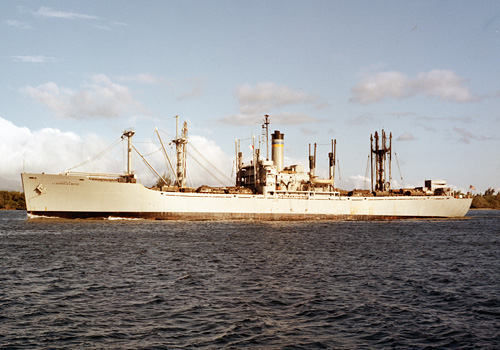
What are the coordinates of `wires` in the screenshot? It's located at (94, 152), (152, 151), (143, 140), (167, 135), (197, 152), (196, 162), (244, 140), (323, 142), (399, 161), (365, 170).